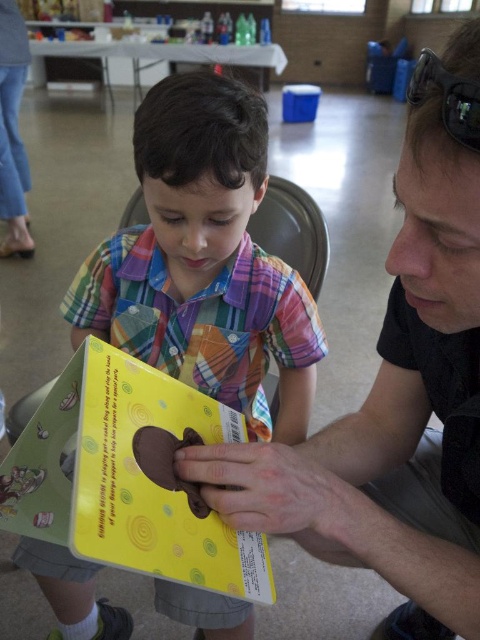
Does yellow paper book at center have a lesser height compared to black plastic goggles at upper right?

No.

How distant is yellow paper book at center from black plastic goggles at upper right?

yellow paper book at center and black plastic goggles at upper right are 18.73 inches apart.

Who is more distant from viewer, (296,408) or (460,77)?

Positioned behind is point (296,408).

What are the coordinates of `yellow paper book at center` in the screenshot? It's located at (204, 260).

Which is more to the left, yellow paper book at center or yellow matte book at center?

From the viewer's perspective, yellow paper book at center appears more on the left side.

Can you confirm if yellow paper book at center is wider than yellow matte book at center?

Correct, the width of yellow paper book at center exceeds that of yellow matte book at center.

What do you see at coordinates (204, 260) in the screenshot?
I see `yellow paper book at center` at bounding box center [204, 260].

The height and width of the screenshot is (640, 480). I want to click on yellow paper book at center, so click(204, 260).

How much distance is there between yellow matte book at center and black plastic goggles at upper right?

yellow matte book at center is 17.48 inches away from black plastic goggles at upper right.

Between yellow matte book at center and black plastic goggles at upper right, which one is positioned higher?

Positioned higher is black plastic goggles at upper right.

The image size is (480, 640). Identify the location of yellow matte book at center. (126, 477).